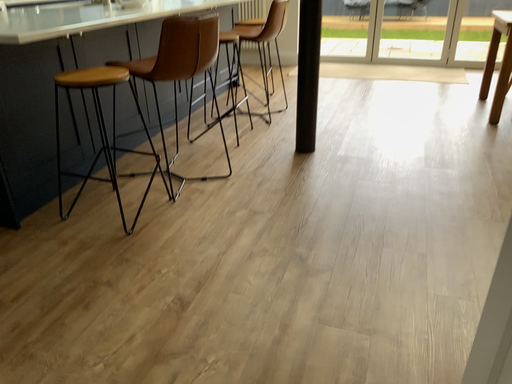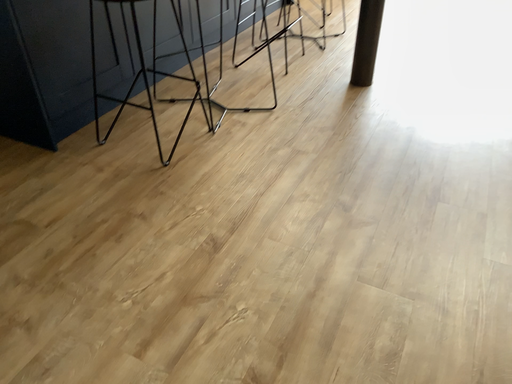
Question: Which way did the camera rotate in the video?

Choices:
 (A) rotated downward
 (B) rotated upward

Answer: (A)